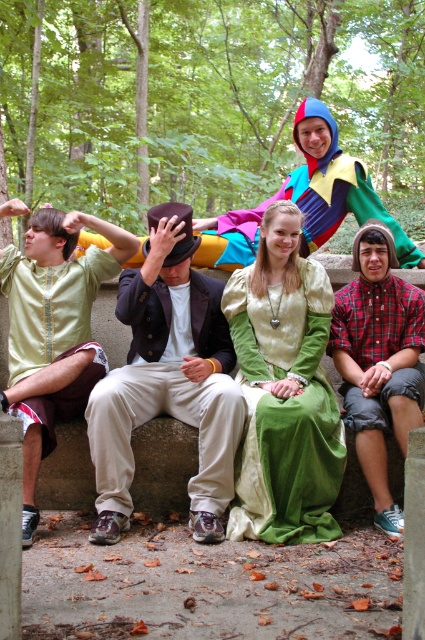
Question: Does matte green fabric at left have a greater width compared to multicolored fabric costume at upper center?

Choices:
 (A) yes
 (B) no

Answer: (B)

Question: Can you confirm if matte brown hat at center is smaller than multicolored fabric costume at upper center?

Choices:
 (A) no
 (B) yes

Answer: (A)

Question: Estimate the real-world distances between objects in this image. Which object is closer to the green velvet dress at center?

Choices:
 (A) plaid shirt at center
 (B) multicolored fabric costume at upper center
 (C) matte brown hat at center

Answer: (A)

Question: Is matte green fabric at left to the right of multicolored fabric costume at upper center from the viewer's perspective?

Choices:
 (A) yes
 (B) no

Answer: (B)

Question: Which point appears closest to the camera in this image?

Choices:
 (A) (16, 333)
 (B) (243, 301)
 (C) (354, 348)

Answer: (B)

Question: Which object is farther from the camera taking this photo?

Choices:
 (A) multicolored fabric costume at upper center
 (B) matte brown hat at center
 (C) matte green fabric at left
 (D) plaid shirt at center

Answer: (A)